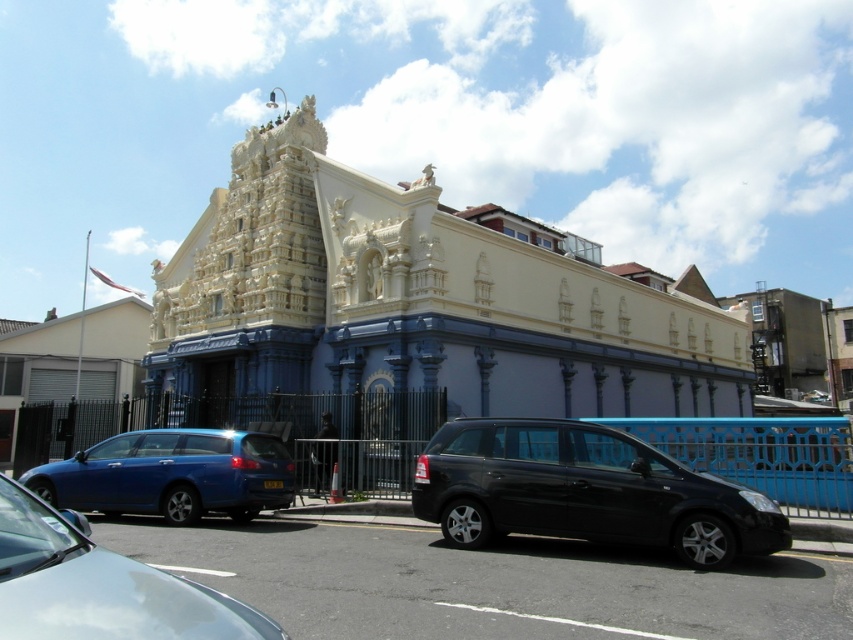
Question: Does black matte van at center have a larger size compared to shiny blue sedan at lower left?

Choices:
 (A) no
 (B) yes

Answer: (A)

Question: Which of the following is the farthest from the observer?

Choices:
 (A) metallic blue station wagon at lower left
 (B) shiny blue sedan at lower left
 (C) black matte van at center
 (D) white stone hindu temple at center

Answer: (D)

Question: Considering the relative positions of white stone hindu temple at center and shiny blue sedan at lower left in the image provided, where is white stone hindu temple at center located with respect to shiny blue sedan at lower left?

Choices:
 (A) above
 (B) below

Answer: (A)

Question: Is white stone hindu temple at center to the left of shiny blue sedan at lower left from the viewer's perspective?

Choices:
 (A) no
 (B) yes

Answer: (A)

Question: Considering the real-world distances, which object is farthest from the metallic blue station wagon at lower left?

Choices:
 (A) black matte van at center
 (B) white stone hindu temple at center
 (C) shiny blue sedan at lower left

Answer: (B)

Question: Estimate the real-world distances between objects in this image. Which object is closer to the shiny blue sedan at lower left?

Choices:
 (A) white stone hindu temple at center
 (B) black matte van at center
 (C) metallic blue station wagon at lower left

Answer: (B)